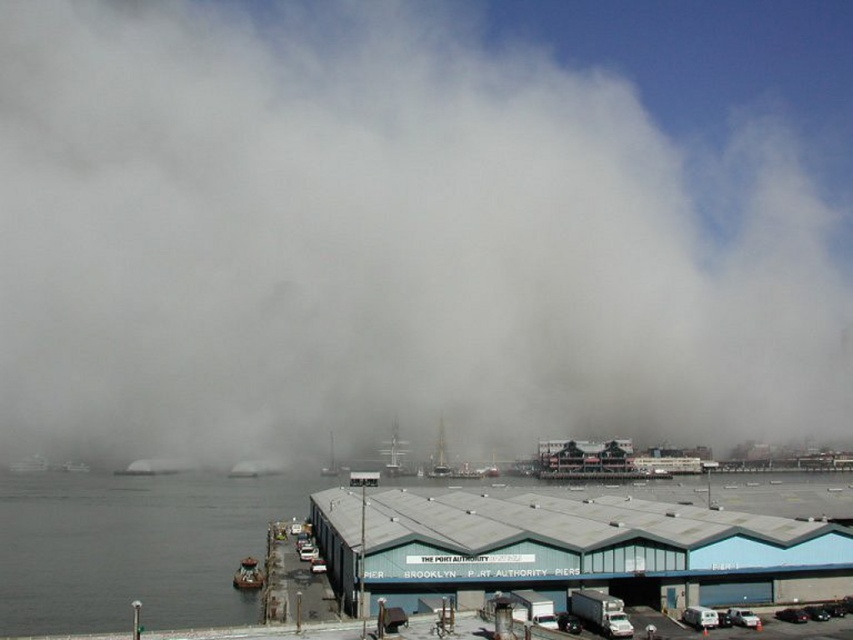
You are a harbor security officer tasked with ensuring safe distances between vessels. According to safety regulations, vessels must maintain a minimum distance of 200 meters apart. Are the metallic gray boat at lower left and the white wooden sailboat at center compliant with this regulation?

The distance between the metallic gray boat at lower left and the white wooden sailboat at center is 229.13 meters, which exceeds the required 200 meters. Therefore, they are compliant with the safety regulation.

You are a photographer planning to capture the waterfront scene. You want to ensure the white fog at center and the metallic gray boat at lower left are both in the frame. Given their sizes, which object will occupy more horizontal space in your photo?

The white fog at center occupies more horizontal space in the photo because its width surpasses that of the metallic gray boat at lower left.

You are a photographer trying to capture the metallic gray boat at lower left without the white fog at center obstructing the view. Is the boat visible through the fog?

The white fog at center has a larger size compared to metallic gray boat at lower left, so the boat might be partially obscured by the fog, but since the boat is smaller, it could still be somewhat visible depending on the fog density.